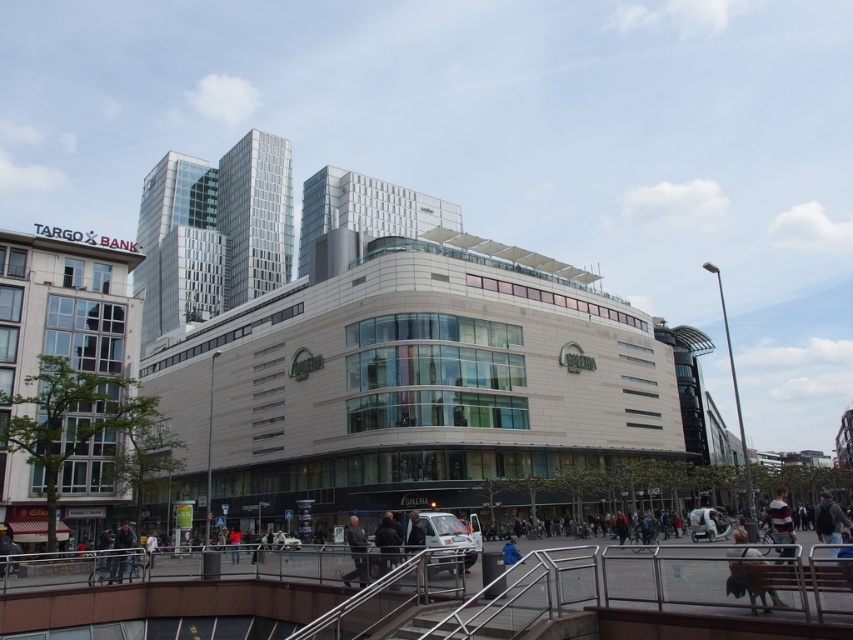
Question: Which of the following is the closest to the observer?

Choices:
 (A) striped sweater at lower right
 (B) blue fabric jacket at lower center

Answer: (A)

Question: Considering the relative positions of light brown leather jacket at lower right and blue fabric jacket at lower center in the image provided, where is light brown leather jacket at lower right located with respect to blue fabric jacket at lower center?

Choices:
 (A) above
 (B) below

Answer: (A)

Question: Does light brown leather jacket at lower right appear on the left side of dark gray suit at center?

Choices:
 (A) no
 (B) yes

Answer: (A)

Question: Can you confirm if light brown leather jacket at lower right is wider than dark gray suit at center?

Choices:
 (A) yes
 (B) no

Answer: (B)

Question: Which point is farther from the camera taking this photo?

Choices:
 (A) (821, 532)
 (B) (115, 579)

Answer: (B)

Question: Which point appears closest to the camera in this image?

Choices:
 (A) (512, 563)
 (B) (778, 513)

Answer: (A)